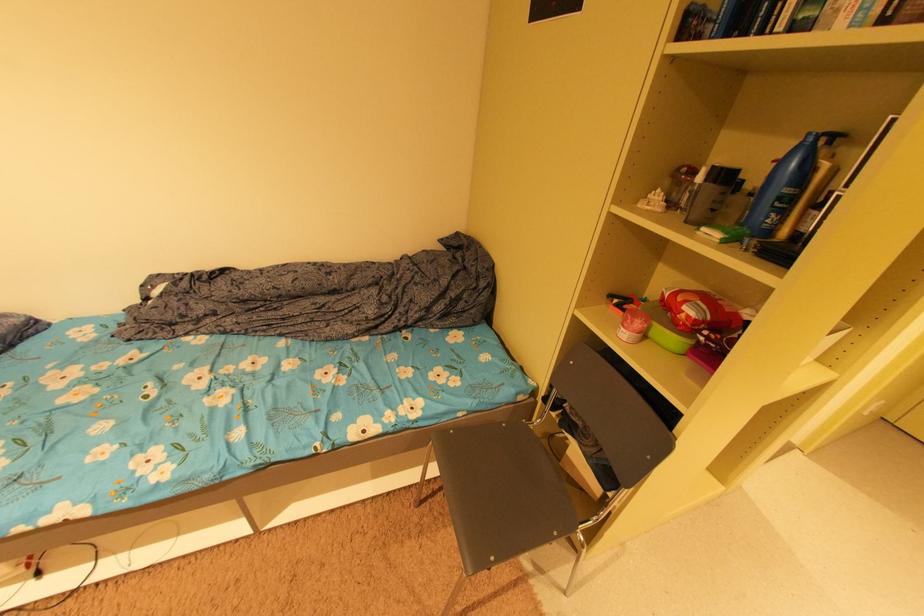
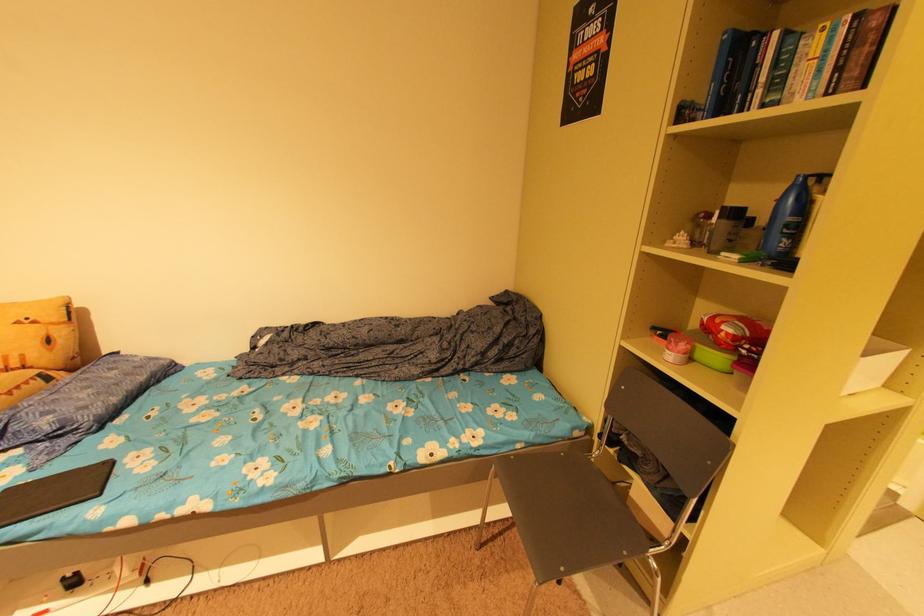
Locate, in the second image, the point that corresponds to point 687,300 in the first image.

(724, 322)